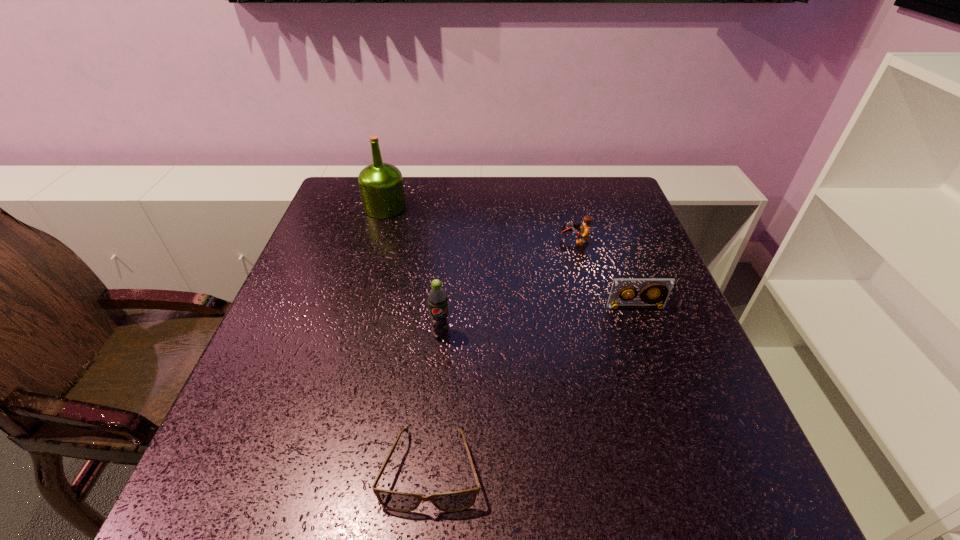
Locate an element on the screen. The width and height of the screenshot is (960, 540). free space between the fourth nearest object and the soda is located at coordinates (508, 288).

The width and height of the screenshot is (960, 540). In order to click on empty location between the nearest object and the olive oil in this screenshot , I will do `click(408, 339)`.

Where is `unoccupied area between the Lego and the fourth farthest object`? The width and height of the screenshot is (960, 540). unoccupied area between the Lego and the fourth farthest object is located at coordinates (508, 288).

The width and height of the screenshot is (960, 540). I want to click on free spot between the fourth nearest object and the videotape, so click(x=606, y=274).

Locate an element on the screen. The height and width of the screenshot is (540, 960). empty location between the videotape and the soda is located at coordinates (539, 321).

Where is `vacant space that is in between the tallest object and the shortest object`? vacant space that is in between the tallest object and the shortest object is located at coordinates (408, 339).

Select which object is the third closest to the leftmost object. Please provide its 2D coordinates. Your answer should be formatted as a tuple, i.e. [(x, y)], where the tuple contains the x and y coordinates of a point satisfying the conditions above.

[(662, 288)]

Point out which object is positioned as the second nearest to the sunglasses. Please provide its 2D coordinates. Your answer should be formatted as a tuple, i.e. [(x, y)], where the tuple contains the x and y coordinates of a point satisfying the conditions above.

[(662, 288)]